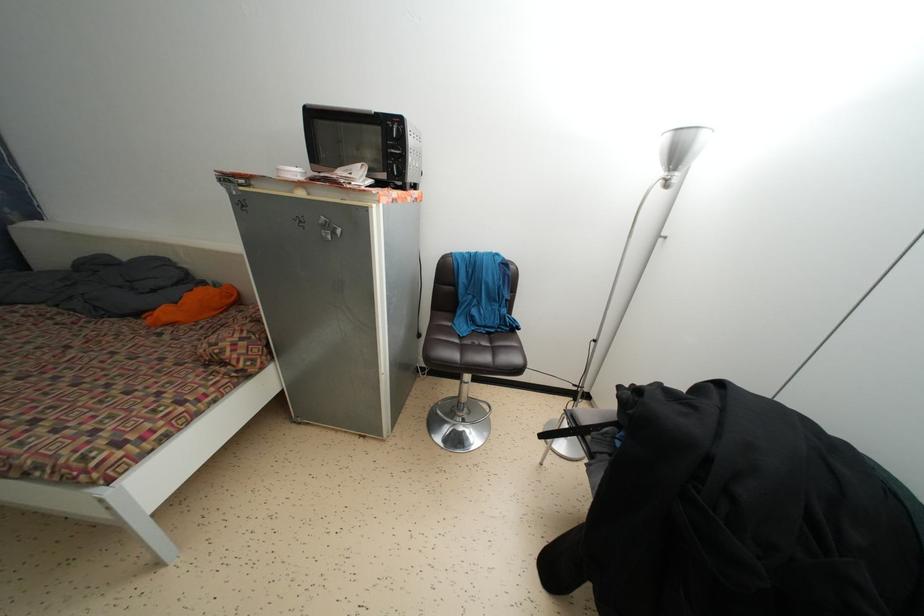
I want to click on oven control dial, so click(x=395, y=161).